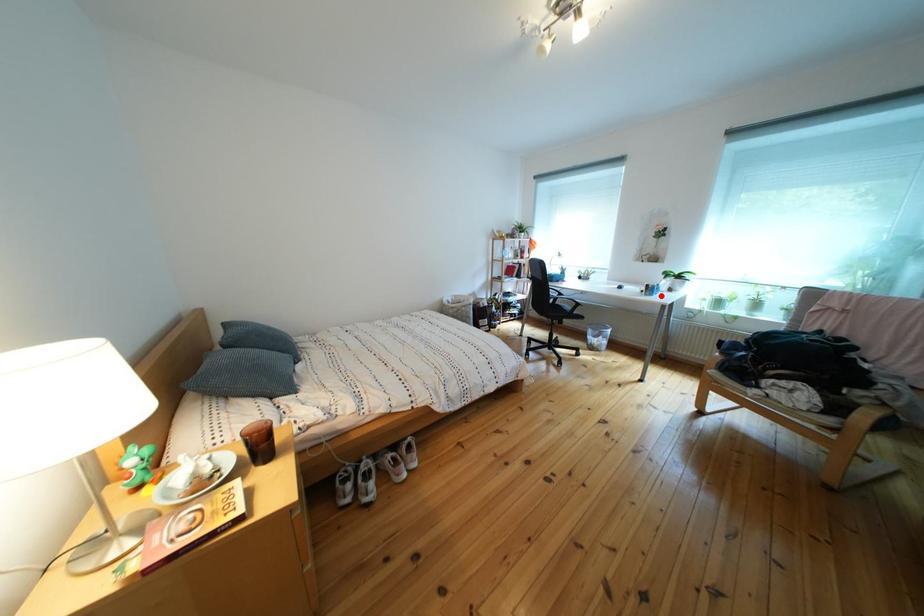
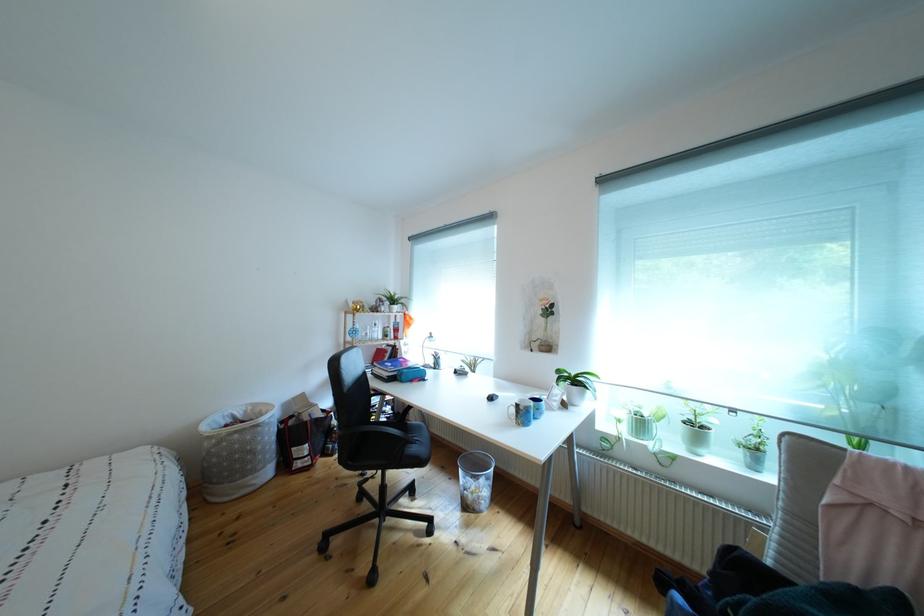
Find the pixel in the second image that matches the highlighted location in the first image.

(533, 419)